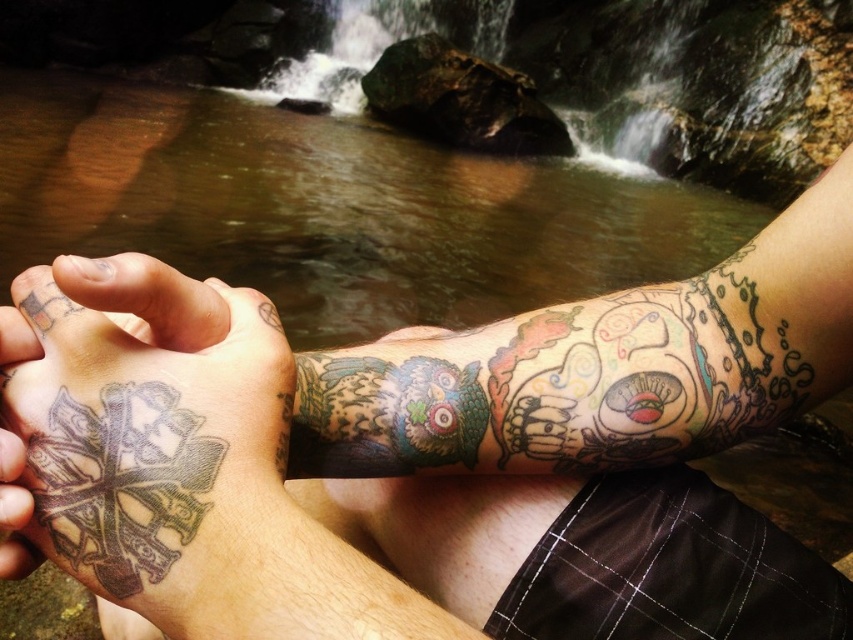
Who is more forward, [112,413] or [27,358]?

Point [112,413] is more forward.

Is gray ink tattoo at lower left shorter than multicolored tattooed hand at lower left?

Incorrect, gray ink tattoo at lower left's height does not fall short of multicolored tattooed hand at lower left's.

Between point (283, 627) and point (4, 356), which one is positioned behind?

The point (4, 356) is more distant.

Locate an element on the screen. gray ink tattoo at lower left is located at coordinates (180, 460).